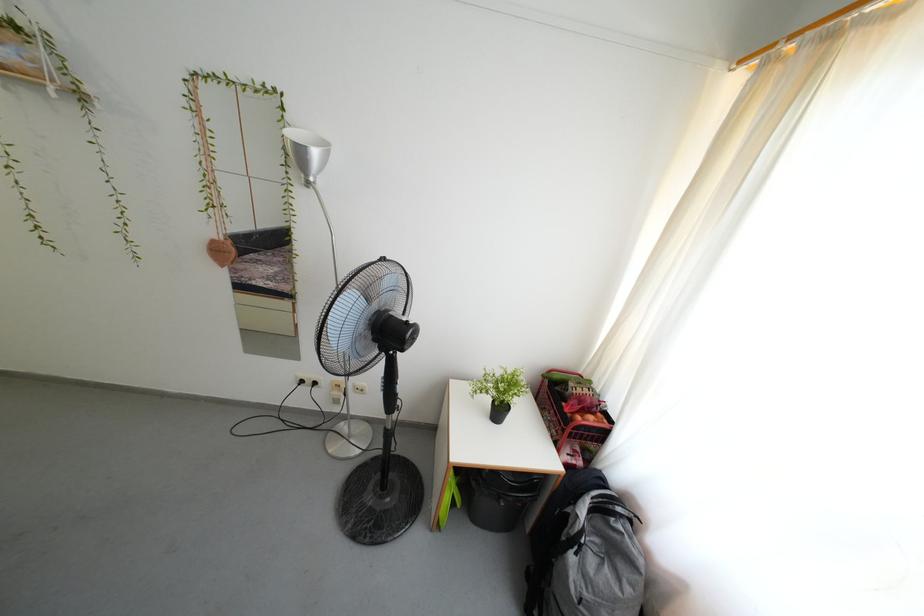
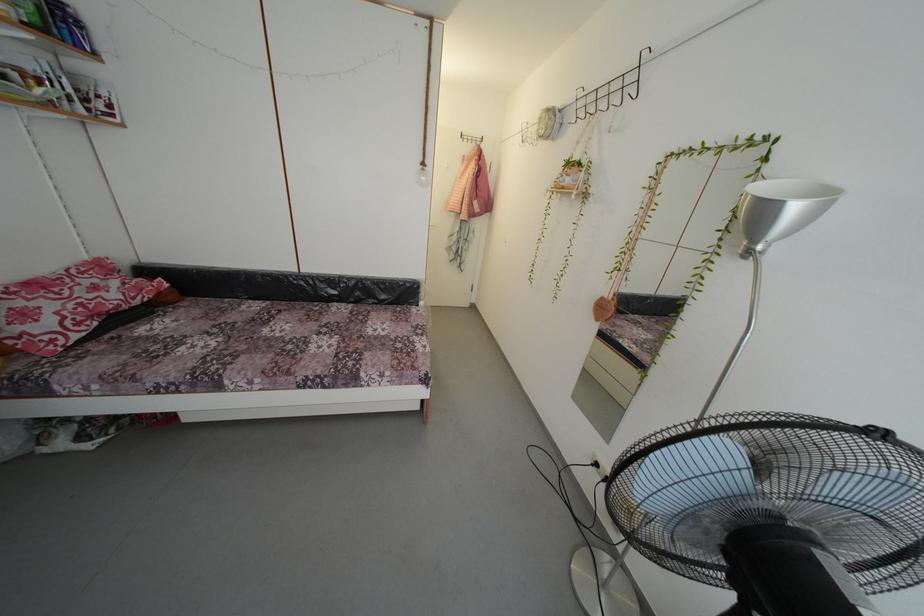
Find the pixel in the second image that matches pixel 219 246 in the first image.

(608, 305)